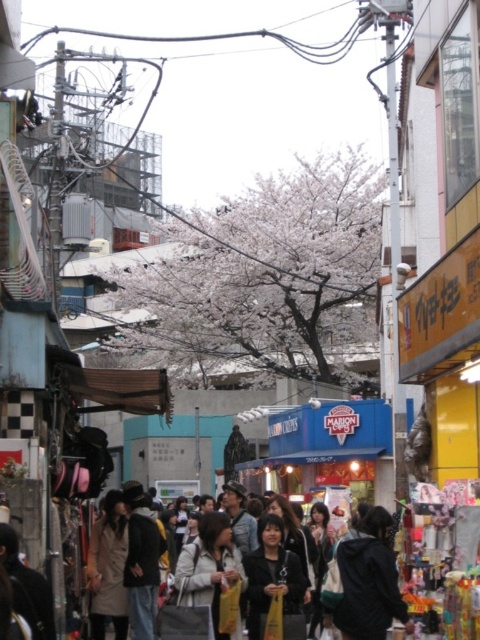
You are standing at the point marked as point (365, 579) in the image. Looking around, you see the dark gray fabric crowd at center. What is the nearest object to your current position?

The nearest object to your current position at point (365, 579) is the dark gray fabric crowd at center since the point directly corresponds to it.

You are a street vendor trying to decide where to place your new stand. You notice two people in the crowd wearing a dark gray hoodie at center and a light beige jacket at center. Which clothing item takes up more space in the crowd?

The dark gray hoodie at center is larger in size than the light beige jacket at center, so the dark gray hoodie at center takes up more space in the crowd.